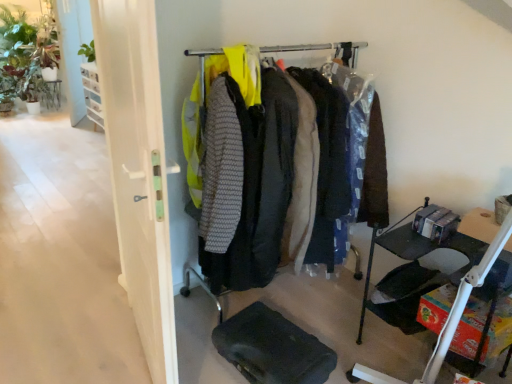
Question: Is point (364, 369) positioned closer to the camera than point (371, 205)?

Choices:
 (A) closer
 (B) farther

Answer: (A)

Question: Is matte black tray at lower right taller or shorter than matte black clothing rack at center?

Choices:
 (A) tall
 (B) short

Answer: (B)

Question: Estimate the real-world distances between objects in this image. Which object is closer to the white glossy door at left?

Choices:
 (A) black fabric folding chair at lower right
 (B) black rubber footrest at lower center
 (C) matte black tray at lower right
 (D) matte black clothing rack at center

Answer: (B)

Question: Estimate the real-world distances between objects in this image. Which object is farther from the black fabric folding chair at lower right?

Choices:
 (A) white glossy door at left
 (B) black rubber footrest at lower center
 (C) matte black clothing rack at center
 (D) matte black tray at lower right

Answer: (A)